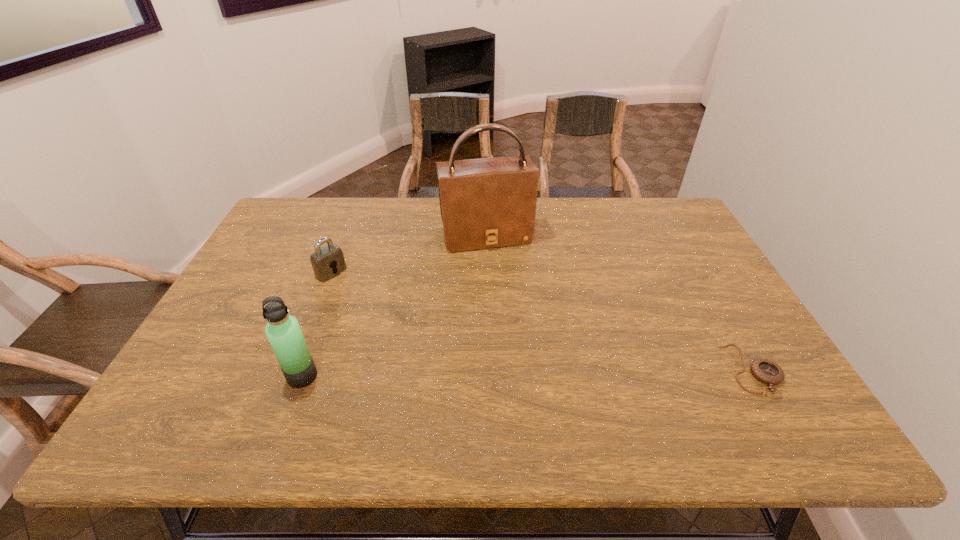
Where is `free space located 0.220m at the front of the second shortest object near the keyhole`? free space located 0.220m at the front of the second shortest object near the keyhole is located at coordinates (392, 315).

Identify the location of vacant space situated 0.350m at the front of the second shortest object near the keyhole. Image resolution: width=960 pixels, height=540 pixels. (427, 339).

Image resolution: width=960 pixels, height=540 pixels. I want to click on free region located on the front flap of the farthest object, so click(510, 299).

At what (x,y) coordinates should I click in order to perform the action: click on vacant area located 0.400m on the front flap of the farthest object. Please return your answer as a coordinate pair (x, y). Looking at the image, I should click on (529, 357).

At what (x,y) coordinates should I click in order to perform the action: click on free region located 0.330m on the front flap of the farthest object. Please return your answer as a coordinate pair (x, y). The width and height of the screenshot is (960, 540). Looking at the image, I should click on (521, 335).

The height and width of the screenshot is (540, 960). Find the location of `object present at the far edge`. object present at the far edge is located at coordinates point(485,203).

Locate an element on the screen. The image size is (960, 540). thermos bottle at the near edge is located at coordinates (283, 331).

Find the location of a particular element. This screenshot has width=960, height=540. pocket watch present at the near edge is located at coordinates (766, 371).

Identify the location of object that is positioned at the right edge. This screenshot has height=540, width=960. (766, 371).

Find the location of `object positioned at the near right corner`. object positioned at the near right corner is located at coordinates (766, 371).